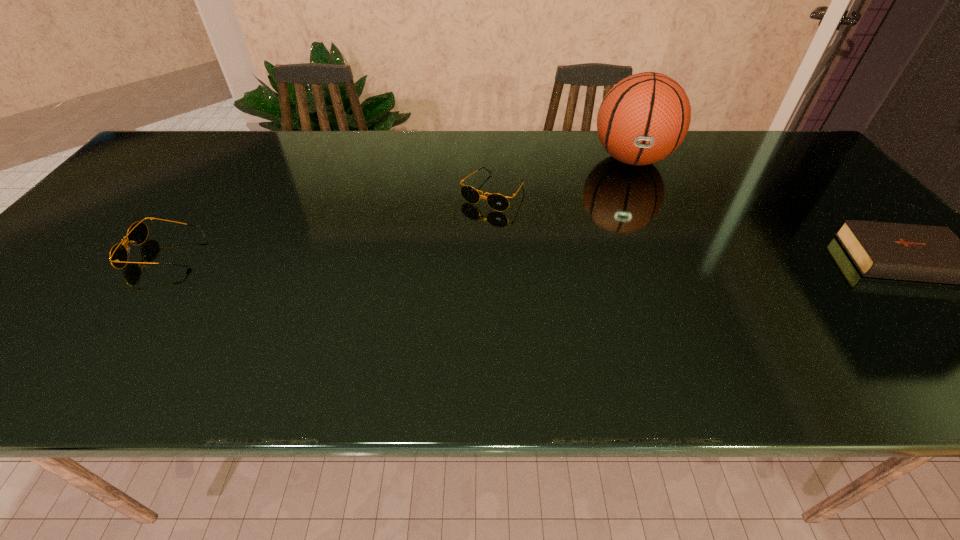
Identify the location of the leftmost object. Image resolution: width=960 pixels, height=540 pixels. (137, 233).

Locate an element on the screen. This screenshot has height=540, width=960. the nearer sunglasses is located at coordinates (137, 233).

This screenshot has width=960, height=540. Find the location of `the third object from left to right`. the third object from left to right is located at coordinates (644, 118).

Identify the location of the tallest object. (644, 118).

Locate an element on the screen. The width and height of the screenshot is (960, 540). the right sunglasses is located at coordinates (498, 202).

Image resolution: width=960 pixels, height=540 pixels. Identify the location of the second object from left to right. (498, 202).

Find the location of `vacant space located on the front-facing side of the left sunglasses`. vacant space located on the front-facing side of the left sunglasses is located at coordinates (81, 253).

Image resolution: width=960 pixels, height=540 pixels. What are the coordinates of `blank space located 0.070m on the front-facing side of the left sunglasses` in the screenshot? It's located at (103, 253).

I want to click on free region located on the front-facing side of the left sunglasses, so click(89, 253).

Identify the location of vacant space located on the side where the inflation valve is located. The width and height of the screenshot is (960, 540). (636, 254).